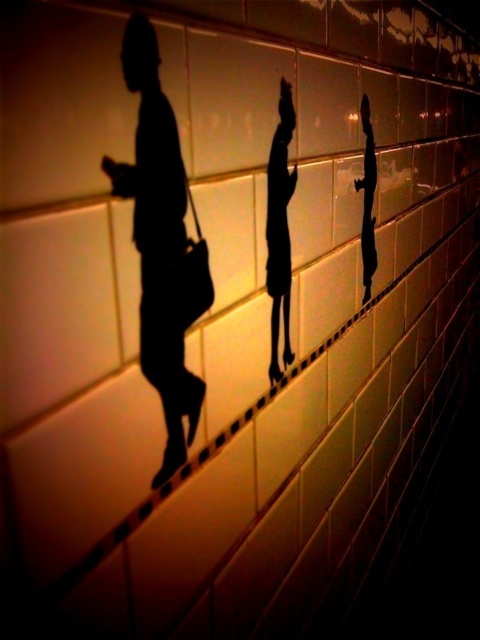
Is black silhouette at left smaller than black matte silhouette at center?

No.

Consider the image. Is black silhouette at left positioned behind black matte silhouette at center?

No, black silhouette at left is in front of black matte silhouette at center.

Locate an element on the screen. black silhouette at left is located at coordinates (157, 241).